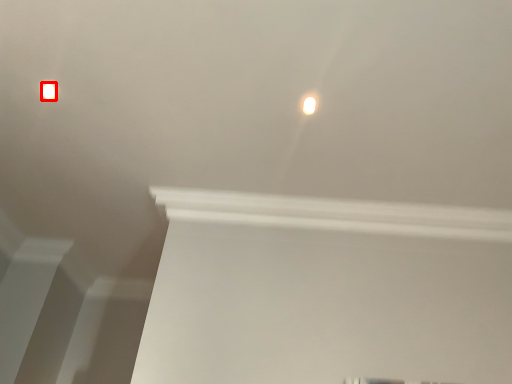
Question: In this image, where is lamp (annotated by the red box) located relative to lamp?

Choices:
 (A) right
 (B) left

Answer: (B)